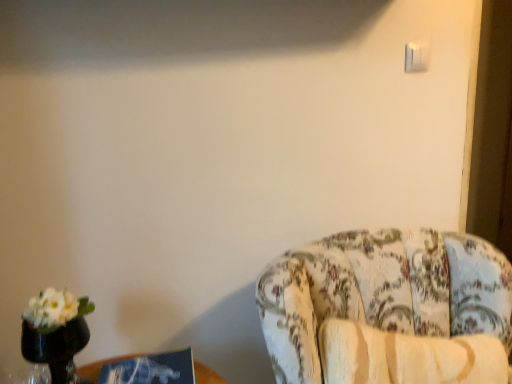
Question: Is point (419, 69) closer or farther from the camera than point (198, 369)?

Choices:
 (A) closer
 (B) farther

Answer: (B)

Question: In terms of size, does white plastic light switch at upper right appear bigger or smaller than blue cardboard box at lower left?

Choices:
 (A) small
 (B) big

Answer: (A)

Question: Which object is the farthest from the white plastic light switch at upper right?

Choices:
 (A) blue cardboard box at lower left
 (B) floral fabric chair at right

Answer: (A)

Question: Estimate the real-world distances between objects in this image. Which object is farther from the floral fabric chair at right?

Choices:
 (A) white plastic light switch at upper right
 (B) blue cardboard box at lower left

Answer: (A)